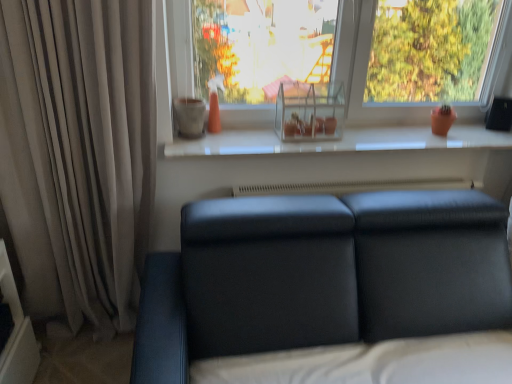
Question: Considering the relative positions of matte black couch at lower center and beige fabric curtain at left in the image provided, is matte black couch at lower center behind beige fabric curtain at left?

Choices:
 (A) yes
 (B) no

Answer: (B)

Question: From the image's perspective, is matte black couch at lower center over beige fabric curtain at left?

Choices:
 (A) no
 (B) yes

Answer: (A)

Question: Does matte black couch at lower center turn towards beige fabric curtain at left?

Choices:
 (A) no
 (B) yes

Answer: (A)

Question: Considering the relative positions of matte black couch at lower center and beige fabric curtain at left in the image provided, is matte black couch at lower center to the right of beige fabric curtain at left from the viewer's perspective?

Choices:
 (A) no
 (B) yes

Answer: (B)

Question: Does matte black couch at lower center have a larger size compared to beige fabric curtain at left?

Choices:
 (A) yes
 (B) no

Answer: (A)

Question: From a real-world perspective, is matte black couch at lower center physically above beige fabric curtain at left?

Choices:
 (A) yes
 (B) no

Answer: (B)

Question: From a real-world perspective, is matte black couch at lower center below white glossy window sill at center?

Choices:
 (A) yes
 (B) no

Answer: (A)

Question: Does matte black couch at lower center have a smaller size compared to white glossy window sill at center?

Choices:
 (A) yes
 (B) no

Answer: (B)

Question: Can you confirm if matte black couch at lower center is bigger than white glossy window sill at center?

Choices:
 (A) yes
 (B) no

Answer: (A)

Question: Does matte black couch at lower center appear on the right side of white glossy window sill at center?

Choices:
 (A) no
 (B) yes

Answer: (A)

Question: Is matte black couch at lower center shorter than white glossy window sill at center?

Choices:
 (A) no
 (B) yes

Answer: (A)

Question: Is matte black couch at lower center positioned far away from white glossy window sill at center?

Choices:
 (A) yes
 (B) no

Answer: (B)

Question: Is beige fabric curtain at left taller than transparent glass shelf at upper center?

Choices:
 (A) no
 (B) yes

Answer: (B)